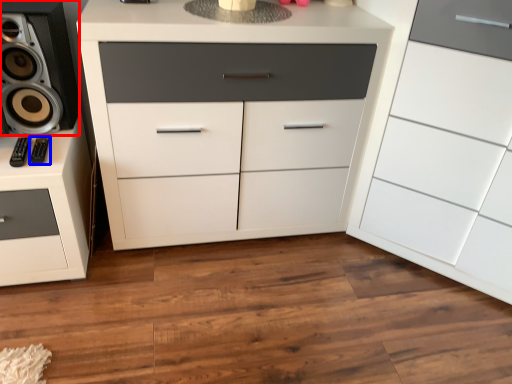
Question: Which point is further to the camera, speaker (highlighted by a red box) or audio (highlighted by a blue box)?

Choices:
 (A) speaker
 (B) audio

Answer: (B)